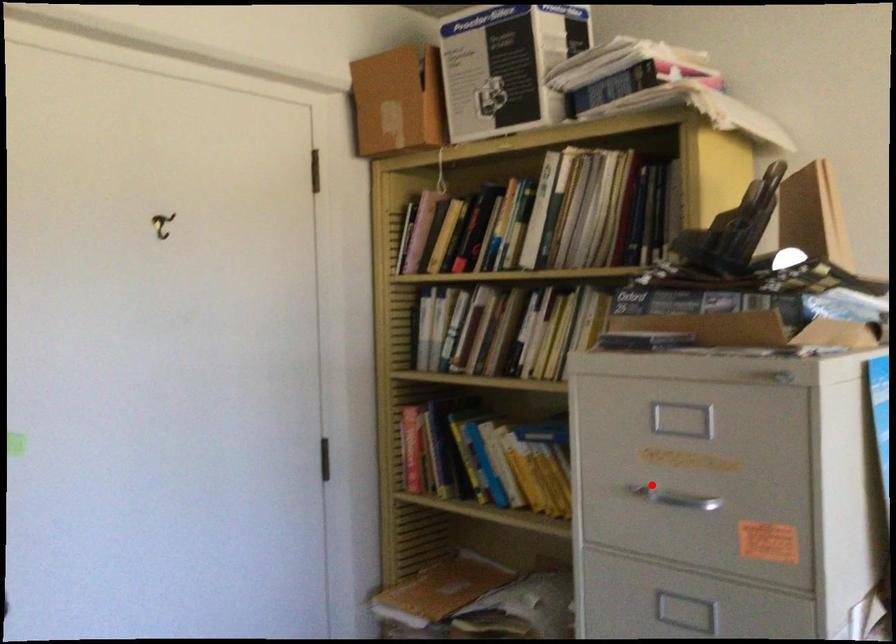
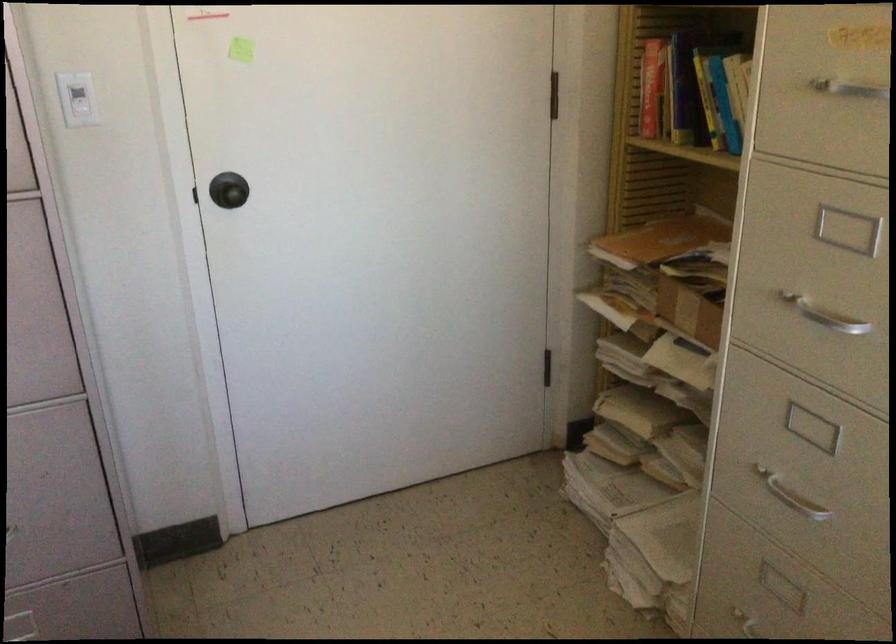
The point at the highlighted location is marked in the first image. Where is the corresponding point in the second image?

(839, 82)